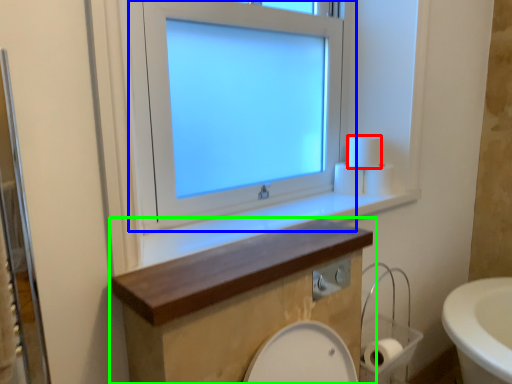
Question: Which object is the closest to the toilet paper (highlighted by a red box)? Choose among these: window (highlighted by a blue box) or bathroom cabinet (highlighted by a green box).

Choices:
 (A) window
 (B) bathroom cabinet

Answer: (A)